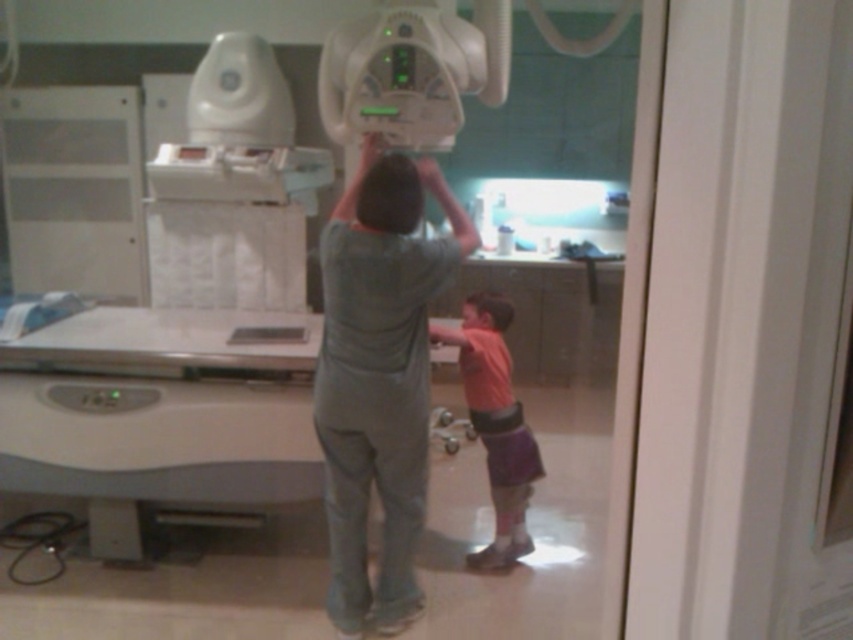
Question: Which point appears farthest from the camera in this image?

Choices:
 (A) (393, 490)
 (B) (503, 326)

Answer: (B)

Question: Can you confirm if gray matte uniform at center is positioned above pink fabric head at lower center?

Choices:
 (A) yes
 (B) no

Answer: (B)

Question: Which object appears closest to the camera in this image?

Choices:
 (A) matte gray head at center
 (B) pink fabric head at lower center
 (C) pink fabric at lower right
 (D) gray matte uniform at center

Answer: (A)

Question: Is gray matte uniform at center to the right of pink fabric at lower right from the viewer's perspective?

Choices:
 (A) yes
 (B) no

Answer: (B)

Question: Which point is farther from the camera taking this photo?

Choices:
 (A) (480, 307)
 (B) (495, 484)
 (C) (389, 225)
 (D) (381, 195)

Answer: (A)

Question: Is matte gray head at center to the right of pink fabric head at lower center from the viewer's perspective?

Choices:
 (A) yes
 (B) no

Answer: (B)